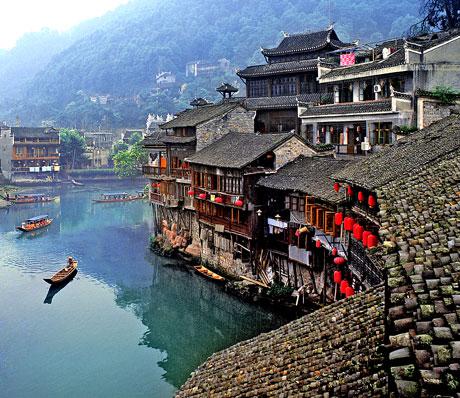
I want to click on multiple windows, so click(x=222, y=183), click(x=318, y=223), click(x=276, y=80).